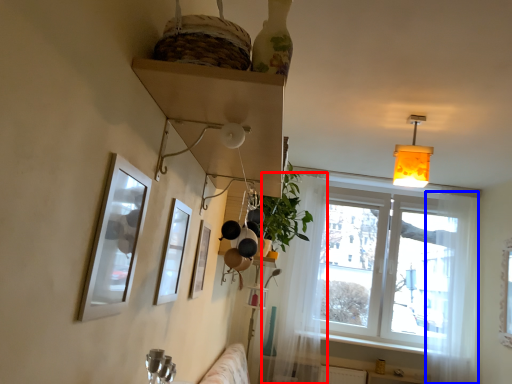
Question: Which point is further to the camera, curtain (highlighted by a red box) or curtain (highlighted by a blue box)?

Choices:
 (A) curtain
 (B) curtain

Answer: (A)